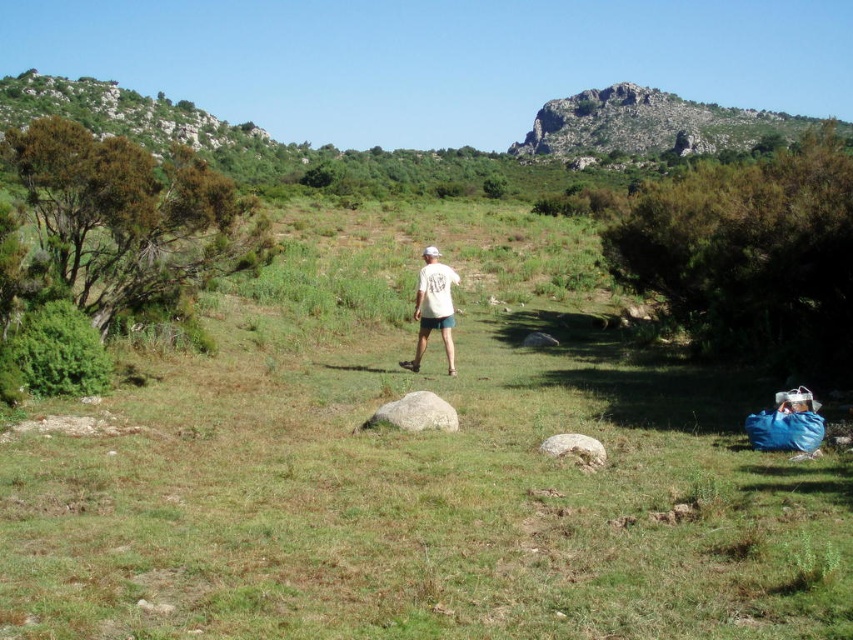
Question: Which point is closer to the camera?

Choices:
 (A) rugged stone hillside at upper right
 (B) gray smooth rock at center
 (C) white cotton shirt at center

Answer: (B)

Question: Considering the real-world distances, which object is farthest from the rugged stone hillside at upper right?

Choices:
 (A) white cotton shirt at center
 (B) green grassy field at center

Answer: (A)

Question: Is green grassy field at center thinner than white cotton shirt at center?

Choices:
 (A) yes
 (B) no

Answer: (B)

Question: Can you confirm if white cotton shirt at center is positioned above gray smooth rock at center?

Choices:
 (A) no
 (B) yes

Answer: (B)

Question: Estimate the real-world distances between objects in this image. Which object is farther from the rugged stone hillside at upper right?

Choices:
 (A) white cotton shirt at center
 (B) gray smooth rock at center
 (C) green grassy field at center

Answer: (A)

Question: Is green grassy field at center positioned before gray smooth rock at center?

Choices:
 (A) no
 (B) yes

Answer: (B)